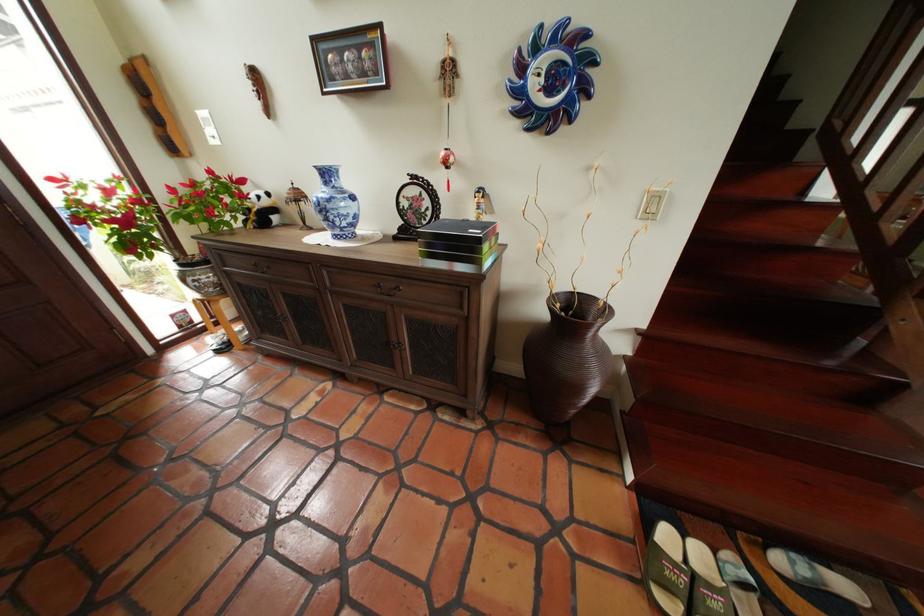
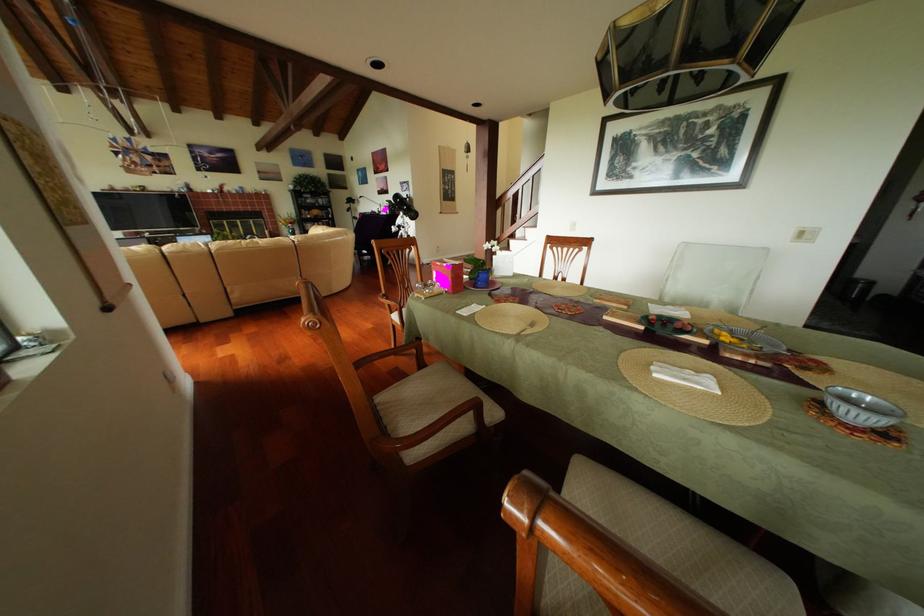
Question: I am providing you with two images of the same scene from different viewpoints. Please identify which objects are invisible in image2.

Choices:
 (A) grey patterned bowl
 (B) orange throw pillow
 (C) green slipper
 (D) wooden chair armrest

Answer: (C)